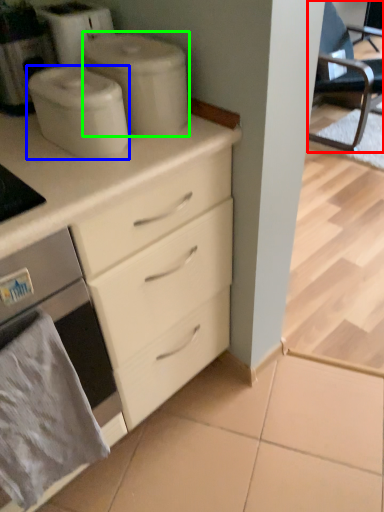
Question: Considering the real-world distances, which object is farthest from chair (highlighted by a red box)? appliance (highlighted by a blue box) or appliance (highlighted by a green box)?

Choices:
 (A) appliance
 (B) appliance

Answer: (A)